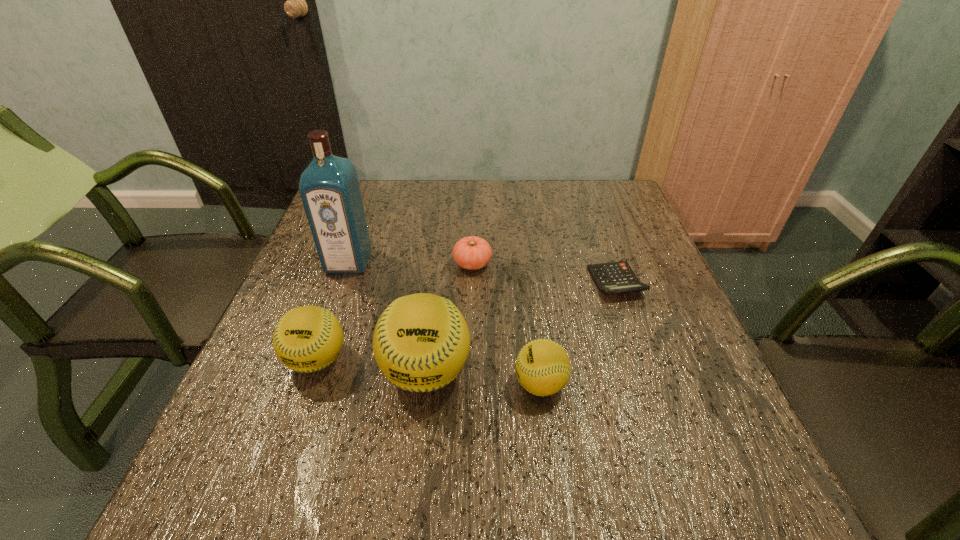
Where is `vacant space in between the second softball from left to right and the calculator`? This screenshot has width=960, height=540. vacant space in between the second softball from left to right and the calculator is located at coordinates (521, 327).

Where is `empty space that is in between the rightmost softball and the rightmost object`? The width and height of the screenshot is (960, 540). empty space that is in between the rightmost softball and the rightmost object is located at coordinates (578, 333).

The width and height of the screenshot is (960, 540). I want to click on vacant area that lies between the tomato and the tallest object, so click(x=411, y=263).

Find the location of `free space between the tomato and the tallest object`. free space between the tomato and the tallest object is located at coordinates (411, 263).

Locate an element on the screen. The image size is (960, 540). unoccupied area between the second tallest object and the shortest softball is located at coordinates (483, 377).

This screenshot has width=960, height=540. Find the location of `object identified as the fifth closest to the tallest softball`. object identified as the fifth closest to the tallest softball is located at coordinates (616, 277).

I want to click on object that is the fourth closest to the tallest object, so click(x=543, y=368).

Identify which softball is the second closest to the rightmost softball. Please provide its 2D coordinates. Your answer should be formatted as a tuple, i.e. [(x, y)], where the tuple contains the x and y coordinates of a point satisfying the conditions above.

[(309, 338)]

Select which softball is the second closest to the calculator. Please provide its 2D coordinates. Your answer should be formatted as a tuple, i.e. [(x, y)], where the tuple contains the x and y coordinates of a point satisfying the conditions above.

[(421, 341)]